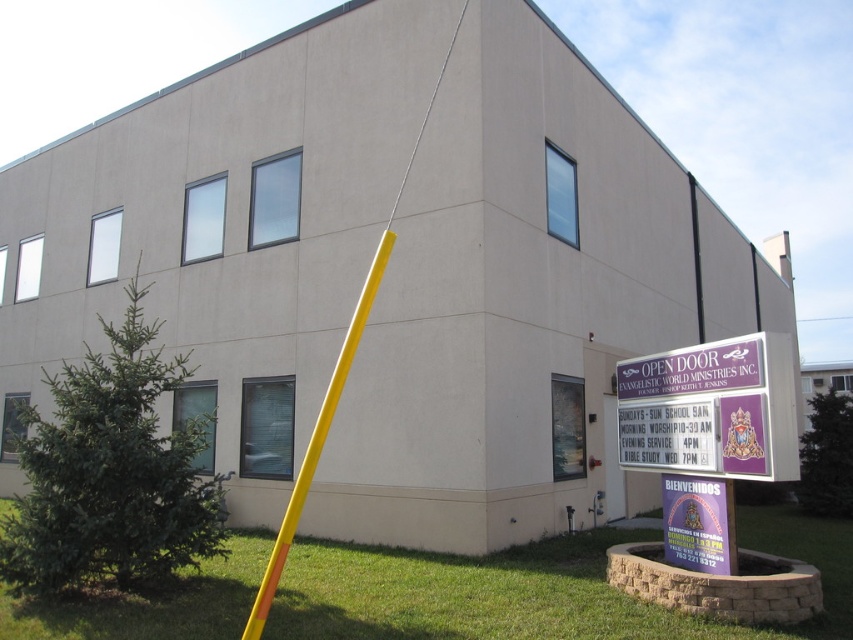
A maintenance worker needs to move a ladder from the point at point (x=310, y=448) to the signboard on the right of the building. The ladder is 10 meters long. Will the ladder reach the signboard?

The distance between the point (x=310, y=448) and the signboard on the right of the building is 9.75 meters. Since the ladder is 10 meters long, it will be long enough to reach the signboard.

You are standing at the entrance of the beige building and want to place a new bench between the yellow plastic pole at center and the purple paper sign at lower right. The bench requires 16 feet of space. Can you fit it between them?

The yellow plastic pole at center is 15.91 feet away from the purple paper sign at lower right, so the bench requiring 16 feet of space cannot fit between them as the distance is slightly less than needed.